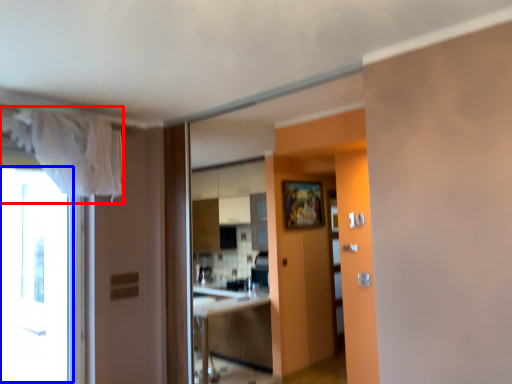
Question: Which object appears closest to the camera in this image, curtain (highlighted by a red box) or window (highlighted by a blue box)?

Choices:
 (A) curtain
 (B) window

Answer: (A)